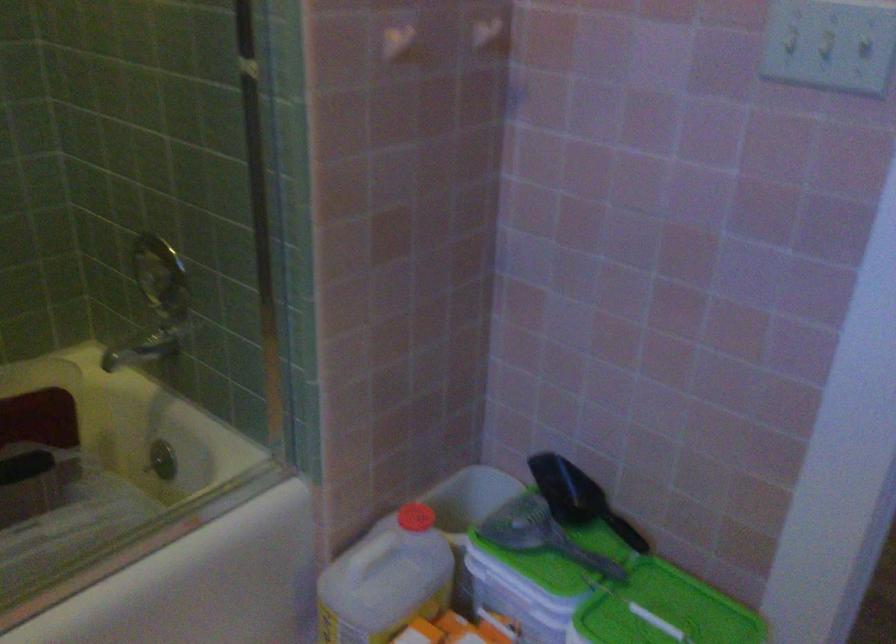
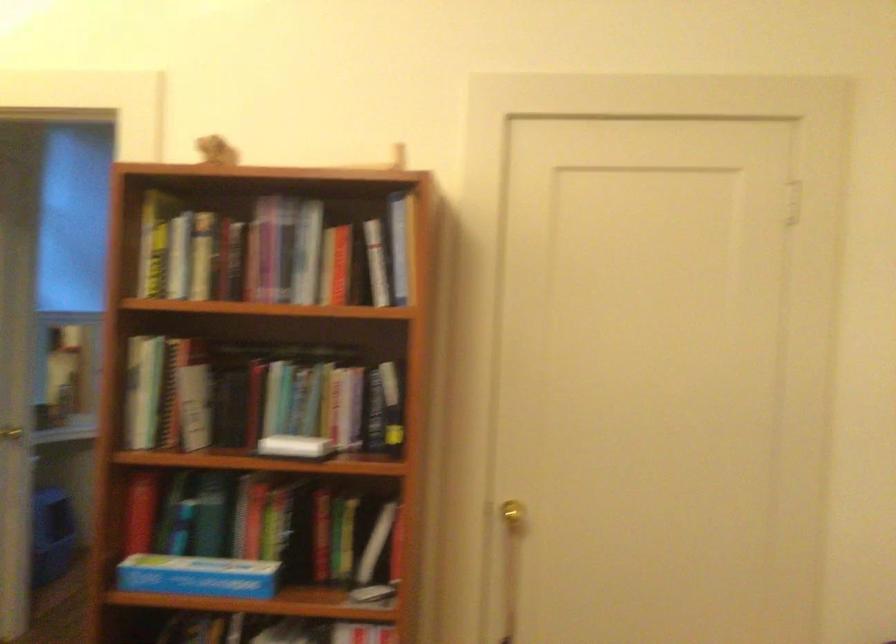
Question: I am providing you with two images of the same scene from different viewpoints. After the viewpoint changes to image2, which objects are now occluded?

Choices:
 (A) blue cardboard box
 (B) white plastic jug
 (C) book
 (D) storage shelf handle

Answer: (B)